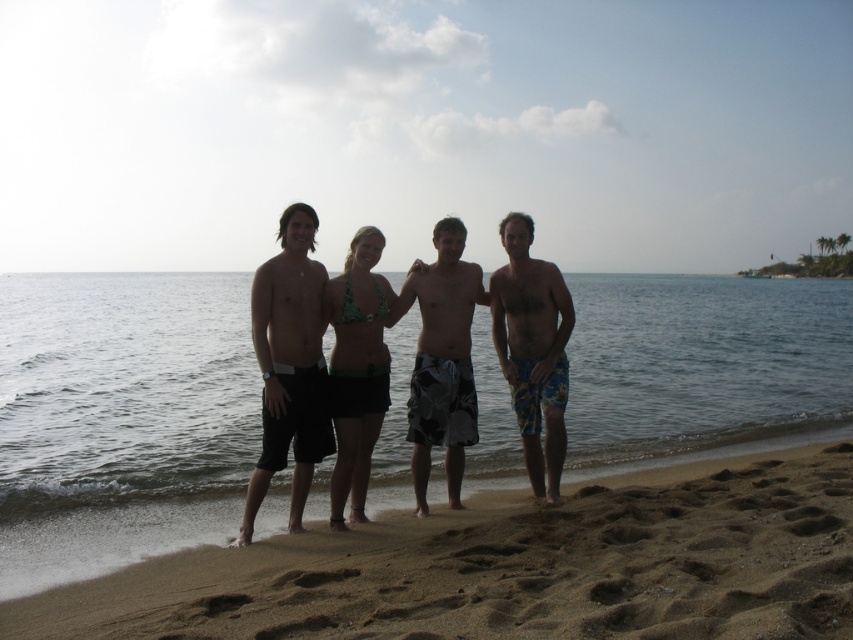
You are a photographer trying to capture a photo of the brown sandy beach at lower center and the green bikini top at center. Which object appears taller in the image?

The green bikini top at center appears taller than the brown sandy beach at lower center because the brown sandy beach at lower center is shorter than the green bikini top at center.

You are standing on the brown sandy beach at lower center and want to give a gift to the person wearing the green bikini top at center. In which direction should you move to reach them?

The green bikini top at center is to the left of the brown sandy beach at lower center, so you should move to your left to reach the person wearing the green bikini top at center.